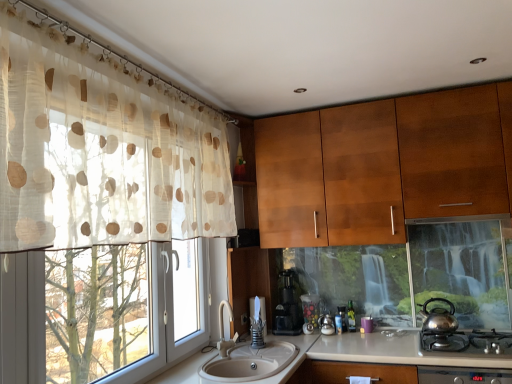
Question: Would you say polished stainless steel kettle at lower right is outside shiny metallic teapot at right?

Choices:
 (A) no
 (B) yes

Answer: (B)

Question: Can you confirm if polished stainless steel kettle at lower right is wider than shiny metallic teapot at right?

Choices:
 (A) yes
 (B) no

Answer: (A)

Question: Is polished stainless steel kettle at lower right with shiny metallic teapot at right?

Choices:
 (A) no
 (B) yes

Answer: (A)

Question: Is polished stainless steel kettle at lower right positioned in front of shiny metallic teapot at right?

Choices:
 (A) no
 (B) yes

Answer: (B)

Question: From the image's perspective, is polished stainless steel kettle at lower right beneath shiny metallic teapot at right?

Choices:
 (A) yes
 (B) no

Answer: (A)

Question: Is black plastic coffee machine at center inside or outside of wooden cabinet at upper center?

Choices:
 (A) inside
 (B) outside

Answer: (B)

Question: In terms of height, does black plastic coffee machine at center look taller or shorter compared to wooden cabinet at upper center?

Choices:
 (A) tall
 (B) short

Answer: (B)

Question: Considering their positions, is black plastic coffee machine at center located in front of or behind wooden cabinet at upper center?

Choices:
 (A) front
 (B) behind

Answer: (B)

Question: Considering the positions of black plastic coffee machine at center and wooden cabinet at upper center in the image, is black plastic coffee machine at center wider or thinner than wooden cabinet at upper center?

Choices:
 (A) thin
 (B) wide

Answer: (A)

Question: Considering the relative positions of polished stainless steel kettle at lower right and black plastic coffee machine at center in the image provided, is polished stainless steel kettle at lower right to the left or to the right of black plastic coffee machine at center?

Choices:
 (A) right
 (B) left

Answer: (A)

Question: From the image's perspective, is polished stainless steel kettle at lower right positioned above or below black plastic coffee machine at center?

Choices:
 (A) below
 (B) above

Answer: (A)

Question: Is polished stainless steel kettle at lower right wider or thinner than black plastic coffee machine at center?

Choices:
 (A) thin
 (B) wide

Answer: (B)

Question: Considering the positions of polished stainless steel kettle at lower right and black plastic coffee machine at center in the image, is polished stainless steel kettle at lower right taller or shorter than black plastic coffee machine at center?

Choices:
 (A) tall
 (B) short

Answer: (B)

Question: Considering their positions, is black plastic coffee machine at center located in front of or behind shiny metallic teapot at right?

Choices:
 (A) behind
 (B) front

Answer: (A)

Question: Is black plastic coffee machine at center spatially inside shiny metallic teapot at right, or outside of it?

Choices:
 (A) inside
 (B) outside

Answer: (B)